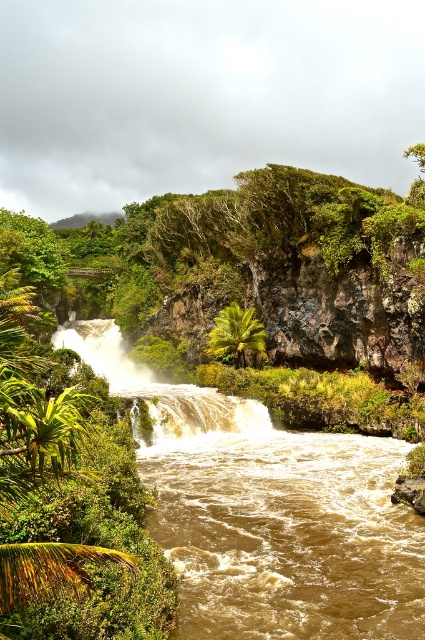
You are standing at a safe distance observing the waterfall. A drone is flying towards the point marked at coordinates point (223, 410). If the drone needs to maintain a minimum altitude of 50 meters above the ground to avoid obstacles, will it be able to safely pass over the point?

The point (223, 410) is 82.67 meters away from the viewer. Since the drone must maintain a minimum altitude of 50 meters, it can safely pass over the point as its altitude is higher than the required minimum.

You are a photographer planning to capture the brown textured waterfall at center and the green leafy palm tree at center in a single frame. Based on their sizes, which object should you focus on to ensure both fit in the composition without cropping?

The brown textured waterfall at center might be wider than the green leafy palm tree at center, so focusing on the waterfall ensures both fit in the composition without cropping.

You are standing at the point marked by coordinates point (161, 387) in the tropical landscape. What natural feature are you positioned at?

You are positioned at the brown textured waterfall at center, as the point (161, 387) represents this feature.